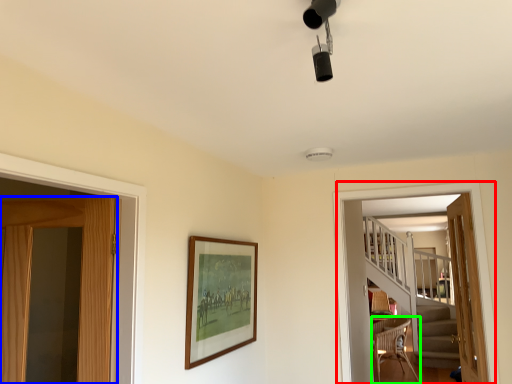
Question: Based on their relative distances, which object is farther from screen door (highlighted by a red box)? Choose from door (highlighted by a blue box) and chair (highlighted by a green box).

Choices:
 (A) door
 (B) chair

Answer: (B)